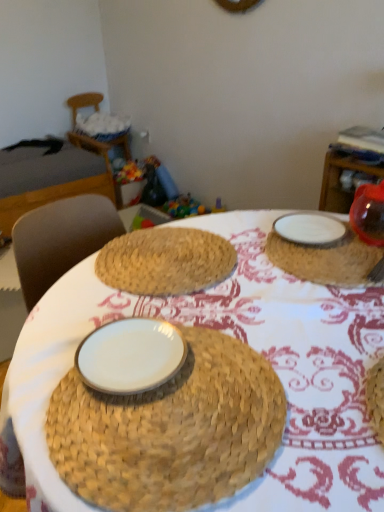
This screenshot has width=384, height=512. In order to click on vacant area on top of white ceramic plate at upper right (from a real-world perspective) in this screenshot , I will do `click(334, 234)`.